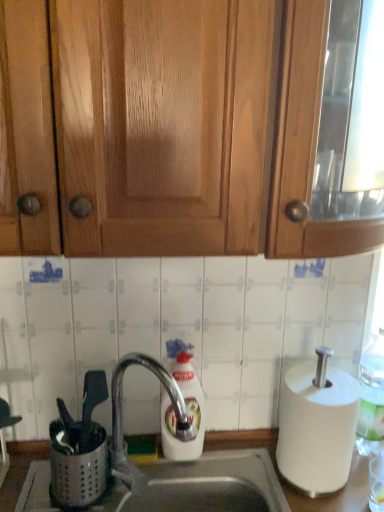
Question: Considering the relative sizes of metallic stainless steel sink at lower center and white matte paper towel at right in the image provided, is metallic stainless steel sink at lower center bigger than white matte paper towel at right?

Choices:
 (A) no
 (B) yes

Answer: (B)

Question: Does metallic stainless steel sink at lower center appear on the right side of white matte paper towel at right?

Choices:
 (A) no
 (B) yes

Answer: (A)

Question: Is metallic stainless steel sink at lower center smaller than white matte paper towel at right?

Choices:
 (A) yes
 (B) no

Answer: (B)

Question: Is there a large distance between metallic stainless steel sink at lower center and white matte paper towel at right?

Choices:
 (A) no
 (B) yes

Answer: (A)

Question: Is metallic stainless steel sink at lower center thinner than white matte paper towel at right?

Choices:
 (A) no
 (B) yes

Answer: (B)

Question: Is metallic stainless steel sink at lower center taller or shorter than wooden cabinet at upper center?

Choices:
 (A) tall
 (B) short

Answer: (B)

Question: Looking at the image, does metallic stainless steel sink at lower center seem bigger or smaller compared to wooden cabinet at upper center?

Choices:
 (A) big
 (B) small

Answer: (B)

Question: From a real-world perspective, is metallic stainless steel sink at lower center positioned above or below wooden cabinet at upper center?

Choices:
 (A) below
 (B) above

Answer: (A)

Question: Is point (264, 430) closer or farther from the camera than point (29, 245)?

Choices:
 (A) closer
 (B) farther

Answer: (B)

Question: In terms of width, does satin chrome faucet at center look wider or thinner when compared to white plastic bottle at right?

Choices:
 (A) thin
 (B) wide

Answer: (B)

Question: Would you say satin chrome faucet at center is to the left or to the right of white plastic bottle at right in the picture?

Choices:
 (A) left
 (B) right

Answer: (A)

Question: Is satin chrome faucet at center bigger or smaller than white plastic bottle at right?

Choices:
 (A) small
 (B) big

Answer: (B)

Question: From the image's perspective, is satin chrome faucet at center positioned above or below white plastic bottle at right?

Choices:
 (A) below
 (B) above

Answer: (A)

Question: Is satin chrome faucet at center inside or outside of wooden cabinet at upper center?

Choices:
 (A) inside
 (B) outside

Answer: (B)

Question: Does point (190, 430) appear closer or farther from the camera than point (324, 161)?

Choices:
 (A) closer
 (B) farther

Answer: (B)